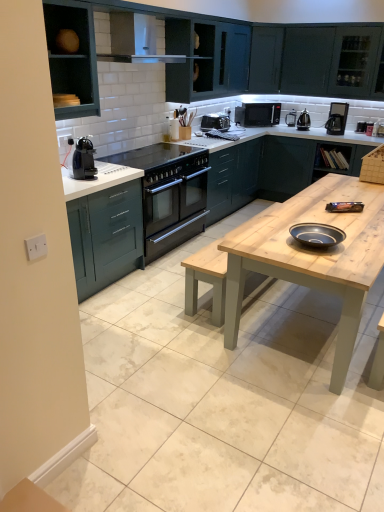
This screenshot has width=384, height=512. Identify the location of vacant space situated on the left part of matte blue bowl at center. (266, 231).